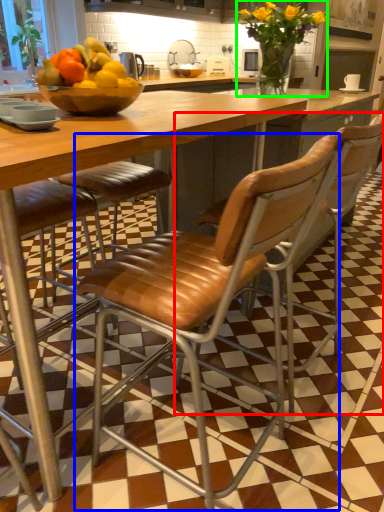
Question: Estimate the real-world distances between objects in this image. Which object is farther from chair (highlighted by a red box), chair (highlighted by a blue box) or flower (highlighted by a green box)?

Choices:
 (A) chair
 (B) flower

Answer: (B)